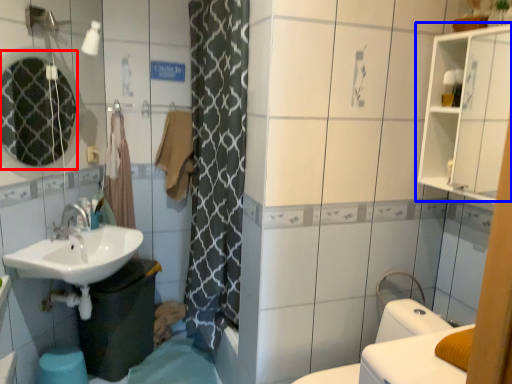
Question: Which point is further to the camera, mirror (highlighted by a red box) or medicine cabinet (highlighted by a blue box)?

Choices:
 (A) mirror
 (B) medicine cabinet

Answer: (A)